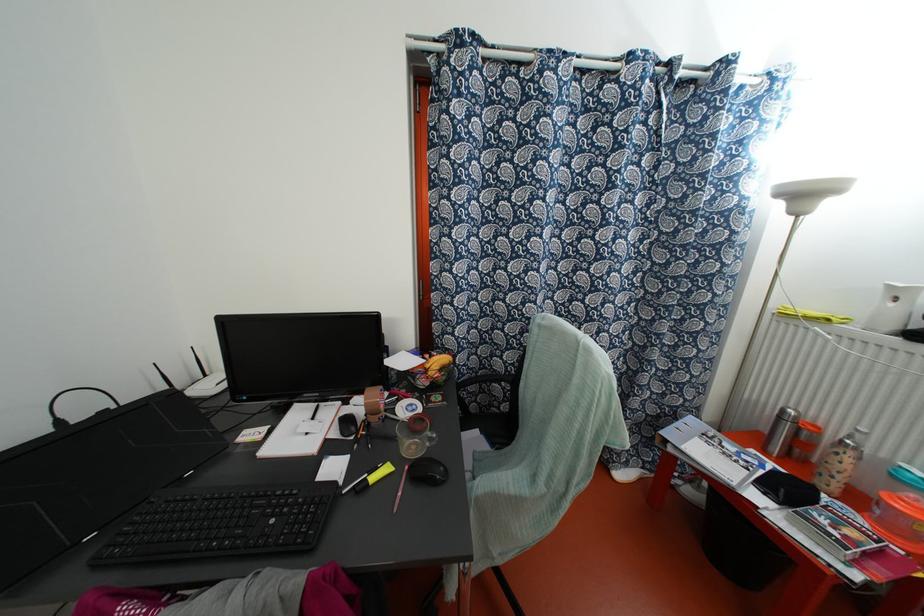
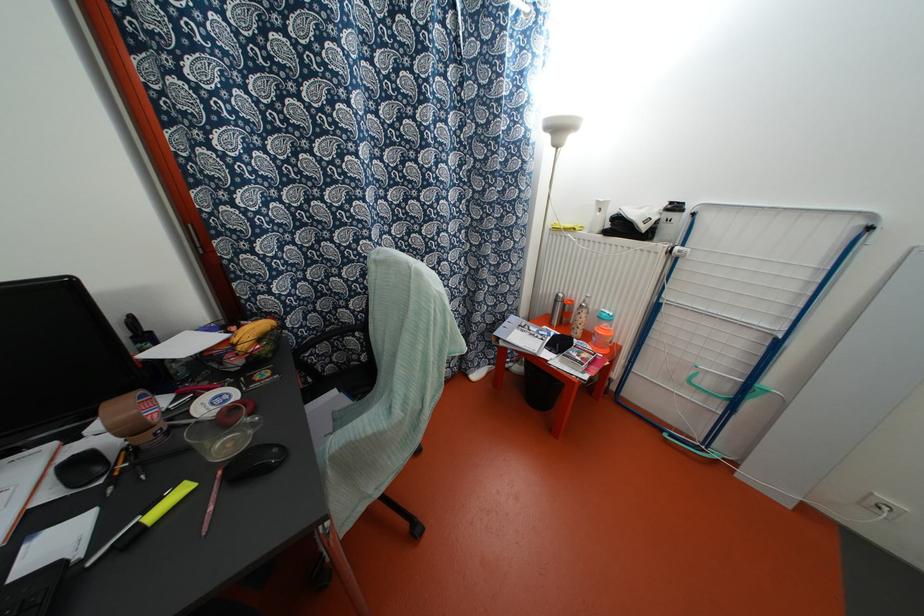
The point at (371, 477) is marked in the first image. Where is the corresponding point in the second image?

(152, 515)